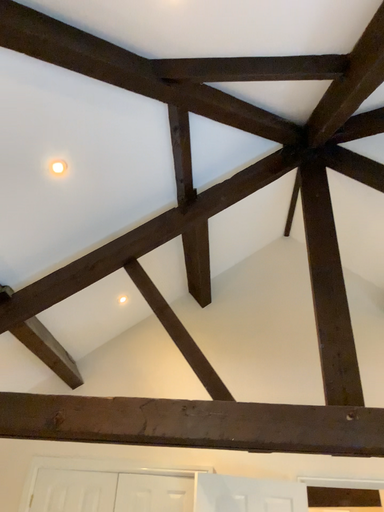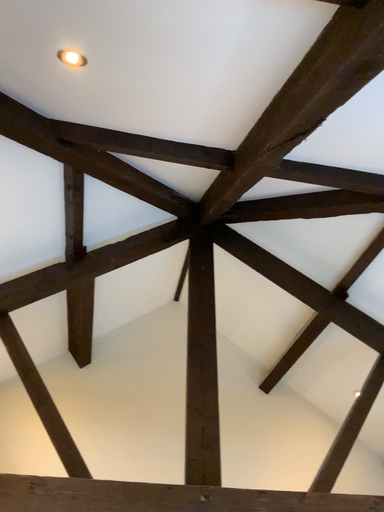
Question: How did the camera likely rotate when shooting the video?

Choices:
 (A) rotated downward
 (B) rotated upward

Answer: (B)